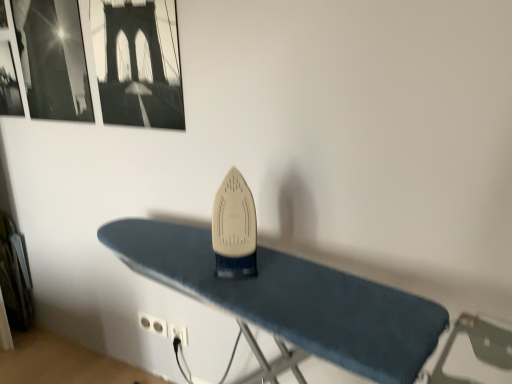
Question: Does blue fabric ironing board at center have a larger size compared to black glossy picture frame at upper left, the first picture frame when ordered from left to right?

Choices:
 (A) yes
 (B) no

Answer: (A)

Question: Is blue fabric ironing board at center thinner than black glossy picture frame at upper left, arranged as the 2th picture frame when viewed from the right?

Choices:
 (A) no
 (B) yes

Answer: (A)

Question: Is blue fabric ironing board at center wider than black glossy picture frame at upper left, arranged as the 2th picture frame when viewed from the right?

Choices:
 (A) no
 (B) yes

Answer: (B)

Question: Is blue fabric ironing board at center to the right of black glossy picture frame at upper left, arranged as the 2th picture frame when viewed from the right, from the viewer's perspective?

Choices:
 (A) yes
 (B) no

Answer: (A)

Question: From a real-world perspective, does blue fabric ironing board at center sit lower than black glossy picture frame at upper left, arranged as the 2th picture frame when viewed from the right?

Choices:
 (A) no
 (B) yes

Answer: (B)

Question: Is point (267, 299) positioned closer to the camera than point (139, 317)?

Choices:
 (A) closer
 (B) farther

Answer: (A)

Question: Is blue fabric ironing board at center in front of or behind white plastic plug at lower center, marked as the 1th plug in a left-to-right arrangement, in the image?

Choices:
 (A) front
 (B) behind

Answer: (A)

Question: Would you say blue fabric ironing board at center is inside or outside white plastic plug at lower center, the 2th plug viewed from the right?

Choices:
 (A) outside
 (B) inside

Answer: (A)

Question: Considering the positions of blue fabric ironing board at center and white plastic plug at lower center, the 2th plug viewed from the right, in the image, is blue fabric ironing board at center bigger or smaller than white plastic plug at lower center, the 2th plug viewed from the right,?

Choices:
 (A) small
 (B) big

Answer: (B)

Question: Is black glossy picture frame at upper left, arranged as the 2th picture frame when viewed from the right, situated inside white plastic plug at lower center, marked as the 1th plug in a left-to-right arrangement, or outside?

Choices:
 (A) outside
 (B) inside

Answer: (A)

Question: From their relative heights in the image, would you say black glossy picture frame at upper left, arranged as the 2th picture frame when viewed from the right, is taller or shorter than white plastic plug at lower center, marked as the 1th plug in a left-to-right arrangement?

Choices:
 (A) short
 (B) tall

Answer: (B)

Question: From a real-world perspective, is black glossy picture frame at upper left, the first picture frame when ordered from left to right, above or below white plastic plug at lower center, marked as the 1th plug in a left-to-right arrangement?

Choices:
 (A) above
 (B) below

Answer: (A)

Question: From the image's perspective, relative to white plastic plug at lower center, marked as the 1th plug in a left-to-right arrangement, is black glossy picture frame at upper left, the first picture frame when ordered from left to right, above or below?

Choices:
 (A) below
 (B) above

Answer: (B)

Question: From the image's perspective, is black plastic plug at lower center, which is counted as the 2th plug, starting from the left, located above or below black paper picture frame at upper left, arranged as the 2th picture frame when viewed from the left?

Choices:
 (A) below
 (B) above

Answer: (A)

Question: In terms of width, does black plastic plug at lower center, which is counted as the 2th plug, starting from the left, look wider or thinner when compared to black paper picture frame at upper left, arranged as the 2th picture frame when viewed from the left?

Choices:
 (A) wide
 (B) thin

Answer: (B)